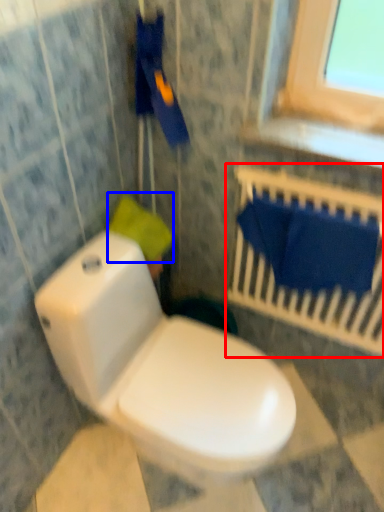
Question: Among these objects, which one is farthest to the camera, balustrade (highlighted by a red box) or toilet paper (highlighted by a blue box)?

Choices:
 (A) balustrade
 (B) toilet paper

Answer: (B)